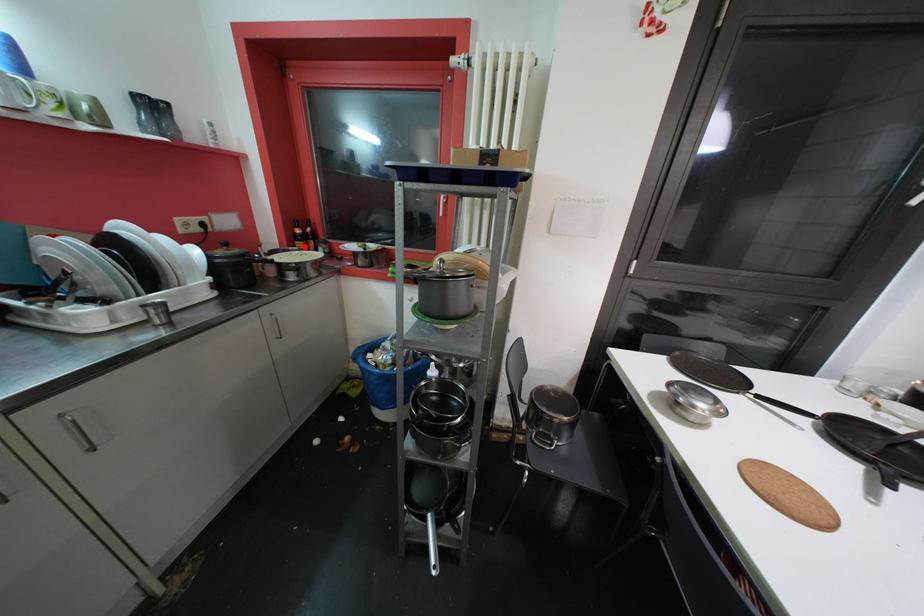
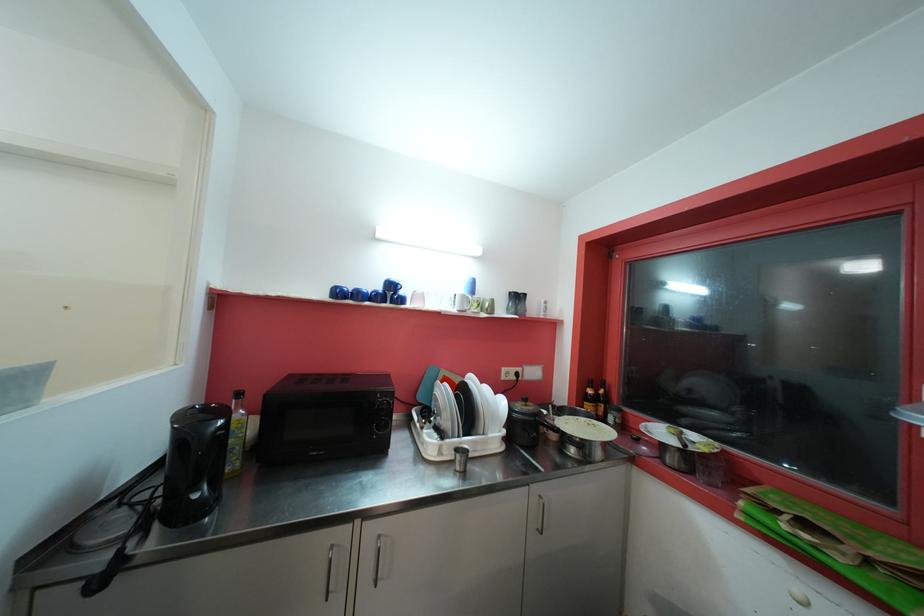
In the second image, find the point that corresponds to the highlighted location in the first image.

(592, 408)